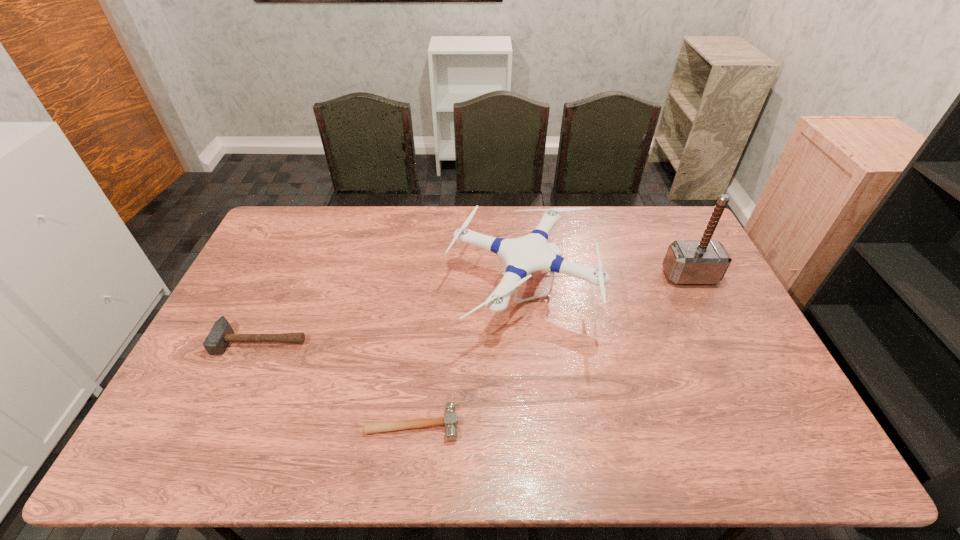
I want to click on vacant space situated 0.140m on the right of the nearest hammer, so (515, 424).

The height and width of the screenshot is (540, 960). I want to click on object that is positioned at the far edge, so click(525, 255).

This screenshot has height=540, width=960. Identify the location of object located at the near edge. (450, 420).

In order to click on object that is at the left edge in this screenshot , I will do click(x=221, y=334).

The image size is (960, 540). Identify the location of object located in the right edge section of the desktop. (686, 262).

Where is `free location at the far edge`? free location at the far edge is located at coordinates (414, 232).

This screenshot has width=960, height=540. In order to click on vacant space at the near edge of the desktop in this screenshot , I will do `click(616, 444)`.

This screenshot has width=960, height=540. In order to click on vacant space at the left edge of the desktop in this screenshot , I will do `click(185, 396)`.

In the image, there is a desktop. Identify the location of free region at the right edge. Image resolution: width=960 pixels, height=540 pixels. (706, 295).

Where is `free area in between the nearest object and the tallest object`? The image size is (960, 540). free area in between the nearest object and the tallest object is located at coordinates (551, 350).